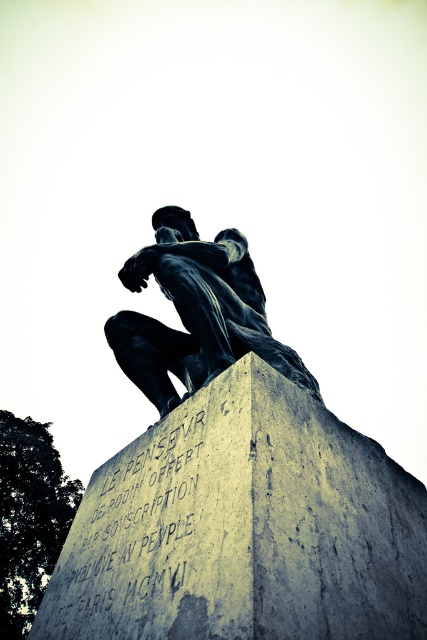
Can you confirm if gray concrete at center is taller than bronze statue at center?

In fact, gray concrete at center may be shorter than bronze statue at center.

In the scene shown: Can you confirm if gray concrete at center is wider than bronze statue at center?

Correct, the width of gray concrete at center exceeds that of bronze statue at center.

What do you see at coordinates (243, 528) in the screenshot? This screenshot has width=427, height=640. I see `gray concrete at center` at bounding box center [243, 528].

Identify the location of gray concrete at center. This screenshot has width=427, height=640. (243, 528).